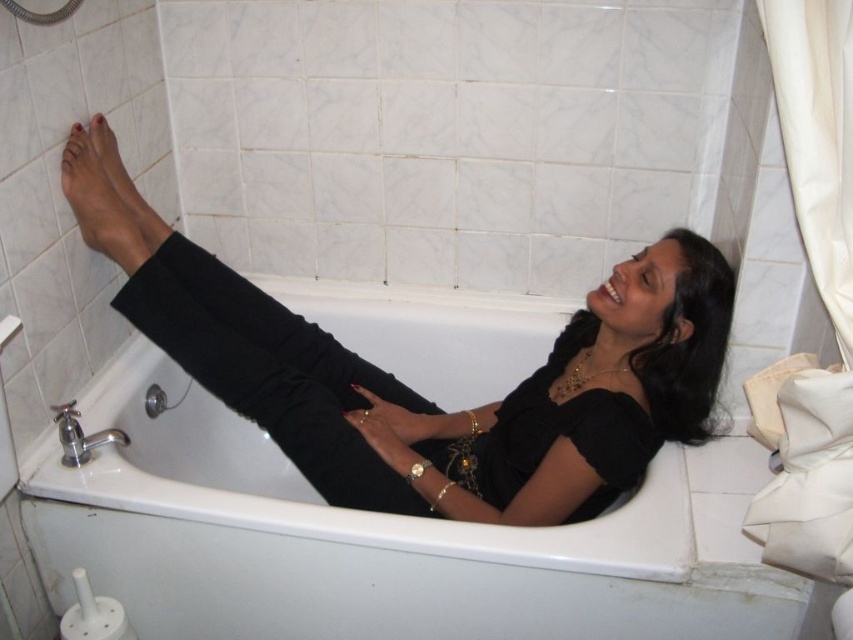
Question: Does white glossy bathtub at center have a greater width compared to matte skin foot at upper left?

Choices:
 (A) no
 (B) yes

Answer: (B)

Question: Which of the following is the farthest from the observer?

Choices:
 (A) (680, 428)
 (B) (119, 228)
 (C) (115, 179)

Answer: (C)

Question: Which point is closer to the camera?

Choices:
 (A) (120, 168)
 (B) (103, 182)

Answer: (B)

Question: Is the position of black matte pants at center less distant than that of matte skin foot at upper left?

Choices:
 (A) yes
 (B) no

Answer: (A)

Question: Does white glossy bathtub at center appear over black matte pants at center?

Choices:
 (A) no
 (B) yes

Answer: (A)

Question: Which point is farther to the camera?

Choices:
 (A) matte skin foot at upper left
 (B) white glossy bathtub at center

Answer: (A)